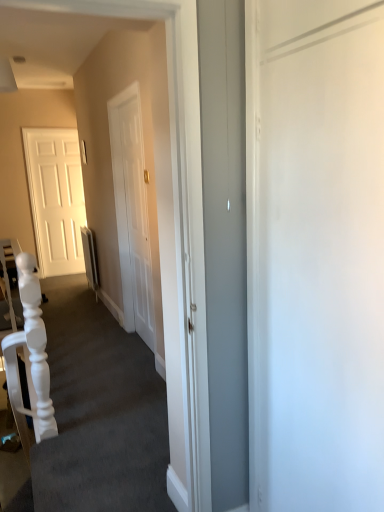
Describe the element at coordinates (100, 414) in the screenshot. I see `white matte stairwell at center` at that location.

The image size is (384, 512). I want to click on white matte armchair at left, so click(30, 354).

The height and width of the screenshot is (512, 384). I want to click on white glossy door at left, so click(x=56, y=198).

At what (x,y) coordinates should I click in order to perform the action: click on door located behind the white matte stairwell at center. Please return your answer as a coordinate pair (x, y). Looking at the image, I should click on (56, 198).

Is white matte stairwell at center at the back of white glossy door at left?

No.

Does white glossy door at left come in front of white matte stairwell at center?

No.

Is white glossy door at left next to white matte stairwell at center and touching it?

No.

Does point (61, 200) lie behind point (52, 426)?

Yes.

The height and width of the screenshot is (512, 384). Find the location of `armchair below the white glossy door at left (from a real-world perspective)`. armchair below the white glossy door at left (from a real-world perspective) is located at coordinates (30, 354).

From the image's perspective, is white glossy door at left over white matte armchair at left?

Yes.

Can you tell me how much white matte armchair at left and white matte stairwell at center differ in facing direction?

92.8 degrees.

Is white matte armchair at left not inside white matte stairwell at center?

That's correct, white matte armchair at left is outside of white matte stairwell at center.

In terms of size, does white matte armchair at left appear bigger or smaller than white matte stairwell at center?

white matte armchair at left is bigger than white matte stairwell at center.

Would you say white matte stairwell at center is to the left or to the right of white glossy door at left in the picture?

From the image, it's evident that white matte stairwell at center is to the right of white glossy door at left.

Considering the sizes of white matte stairwell at center and white glossy door at left in the image, is white matte stairwell at center taller or shorter than white glossy door at left?

Considering their sizes, white matte stairwell at center has less height than white glossy door at left.

Which point is more forward, [136,372] or [41,255]?

The point [136,372] is in front.

Based on the photo, in terms of size, does white matte stairwell at center appear bigger or smaller than white glossy door at left?

white matte stairwell at center is bigger than white glossy door at left.

Between white matte stairwell at center and white matte armchair at left, which one has larger size?

With larger size is white matte armchair at left.

Considering the relative positions of white matte stairwell at center and white matte armchair at left in the image provided, is white matte stairwell at center behind white matte armchair at left?

No, white matte stairwell at center is closer to the viewer.

Is white matte stairwell at center positioned with its back to white matte armchair at left?

No.

Where is `stairwell in front of the white matte armchair at left`? The image size is (384, 512). stairwell in front of the white matte armchair at left is located at coordinates (100, 414).

Which of these two, white matte armchair at left or white glossy door at left, is bigger?

white matte armchair at left.

Is white matte armchair at left facing away from white glossy door at left?

No, white matte armchair at left is not facing the opposite direction of white glossy door at left.

From a real-world perspective, which is physically below, white matte armchair at left or white glossy door at left?

In real-world perspective, white matte armchair at left is lower.

Is white matte armchair at left to the left or to the right of white glossy door at left in the image?

→ Based on their positions, white matte armchair at left is located to the right of white glossy door at left.

Where is `stairwell in front of the white glossy door at left`? The height and width of the screenshot is (512, 384). stairwell in front of the white glossy door at left is located at coordinates (100, 414).

The height and width of the screenshot is (512, 384). I want to click on door on the left of white matte armchair at left, so click(x=56, y=198).

Estimate the real-world distances between objects in this image. Which object is closer to white matte armchair at left, white matte stairwell at center or white glossy door at left?

white matte stairwell at center lies closer to white matte armchair at left than the other object.

Consider the image. When comparing their distances from white matte armchair at left, does white glossy door at left or white matte stairwell at center seem further?

white glossy door at left lies further to white matte armchair at left than the other object.

Looking at the image, which one is located further to white glossy door at left, white matte stairwell at center or white matte armchair at left?

white matte armchair at left.

Which object lies further to the anchor point white glossy door at left, white matte armchair at left or white matte stairwell at center?

Among the two, white matte armchair at left is located further to white glossy door at left.

Considering their positions, is white glossy door at left positioned further to white matte stairwell at center than white matte armchair at left?

white glossy door at left is further to white matte stairwell at center.

When comparing their distances from white matte stairwell at center, does white matte armchair at left or white glossy door at left seem further?

The object further to white matte stairwell at center is white glossy door at left.

This screenshot has height=512, width=384. Find the location of `armchair between white matte stairwell at center and white glossy door at left from front to back`. armchair between white matte stairwell at center and white glossy door at left from front to back is located at coordinates pyautogui.click(x=30, y=354).